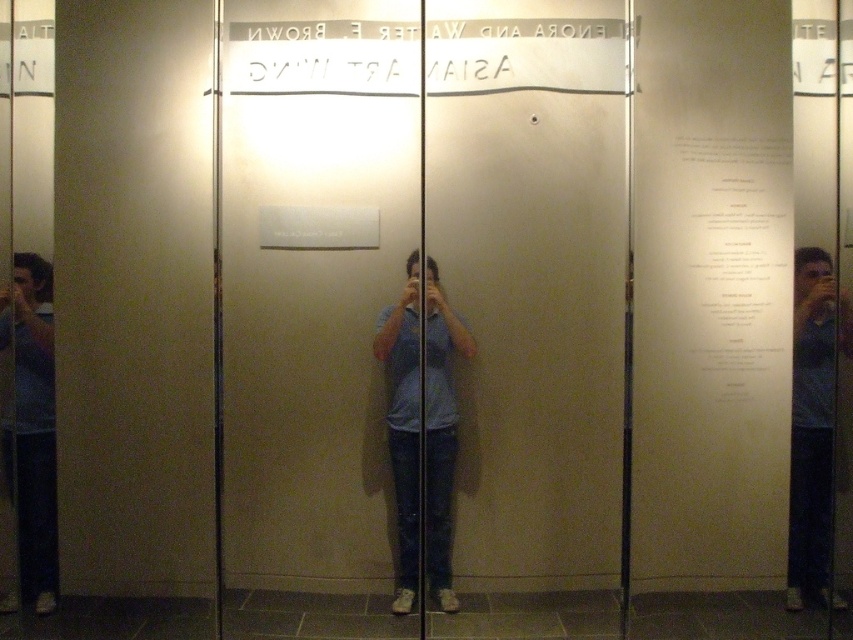
Which is behind, point (798, 401) or point (48, 385)?

The point (798, 401) is more distant.

Does blue denim jeans at right appear on the left side of matte blue shirt at left?

In fact, blue denim jeans at right is to the right of matte blue shirt at left.

Between point (831, 374) and point (22, 360), which one is positioned in front?

Point (22, 360) is more forward.

Find the location of a particular element. Image resolution: width=853 pixels, height=640 pixels. blue denim jeans at right is located at coordinates coord(813,422).

Which of these two, light blue fabric at center or blue denim jeans at right, stands taller?

With more height is light blue fabric at center.

Who is shorter, light blue fabric at center or blue denim jeans at right?

blue denim jeans at right is shorter.

Between point (393, 413) and point (820, 336), which one is positioned behind?

The point (393, 413) is more distant.

Locate an element on the screen. This screenshot has height=640, width=853. light blue fabric at center is located at coordinates (403, 422).

Who is positioned more to the right, transparent glass door at center or light blue fabric at center?

From the viewer's perspective, light blue fabric at center appears more on the right side.

Which is behind, point (265, 208) or point (413, 464)?

The point (413, 464) is more distant.

Between point (527, 144) and point (444, 401), which one is positioned in front?

Point (527, 144) is more forward.

Where is `transparent glass door at center`? transparent glass door at center is located at coordinates (422, 314).